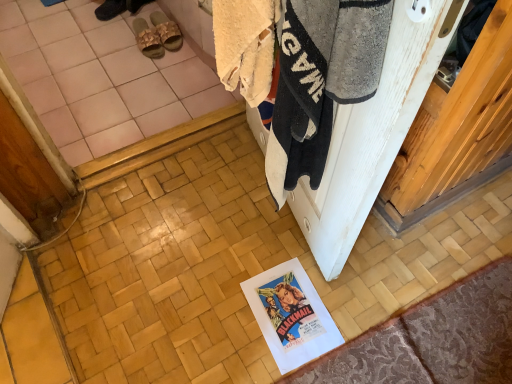
Identify the location of vacant area situated below white fluffy towel at upper right (from a real-world perspective). Image resolution: width=512 pixels, height=384 pixels. (247, 189).